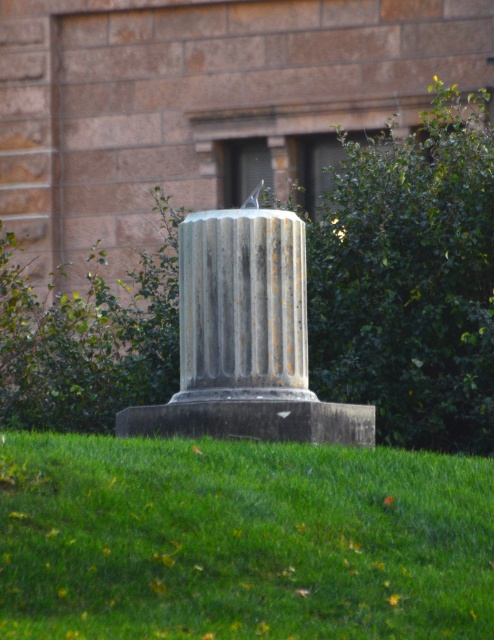
Question: Which of these objects is positioned farthest from the gray stone column at center?

Choices:
 (A) green grass at center
 (B) green leafy bush at center

Answer: (B)

Question: Which point is farther from the camera taking this photo?

Choices:
 (A) (374, 278)
 (B) (250, 588)

Answer: (A)

Question: Estimate the real-world distances between objects in this image. Which object is closer to the gray stone column at center?

Choices:
 (A) green leafy bush at center
 (B) green grass at center

Answer: (B)

Question: Is the position of green grass at center more distant than that of gray stone column at center?

Choices:
 (A) yes
 (B) no

Answer: (B)

Question: Is green grass at center smaller than gray stone column at center?

Choices:
 (A) yes
 (B) no

Answer: (B)

Question: Observing the image, what is the correct spatial positioning of green leafy bush at center in reference to gray stone column at center?

Choices:
 (A) left
 (B) right

Answer: (B)